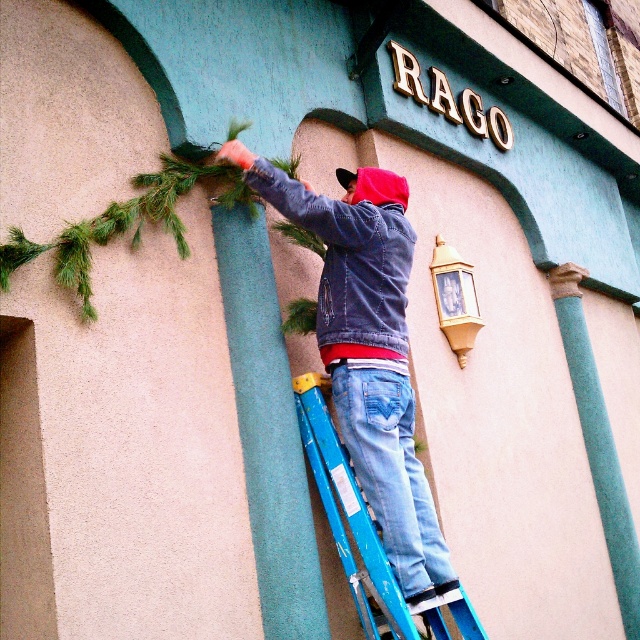
Which is behind, point (410, 573) or point (364, 548)?

Positioned behind is point (364, 548).

In the scene shown: Between denim jacket at center and blue metallic ladder at center, which one appears on the left side from the viewer's perspective?

blue metallic ladder at center

Between point (408, 420) and point (394, 582), which one is positioned behind?

Positioned behind is point (408, 420).

Find the location of `denim jacket at center`. denim jacket at center is located at coordinates (369, 353).